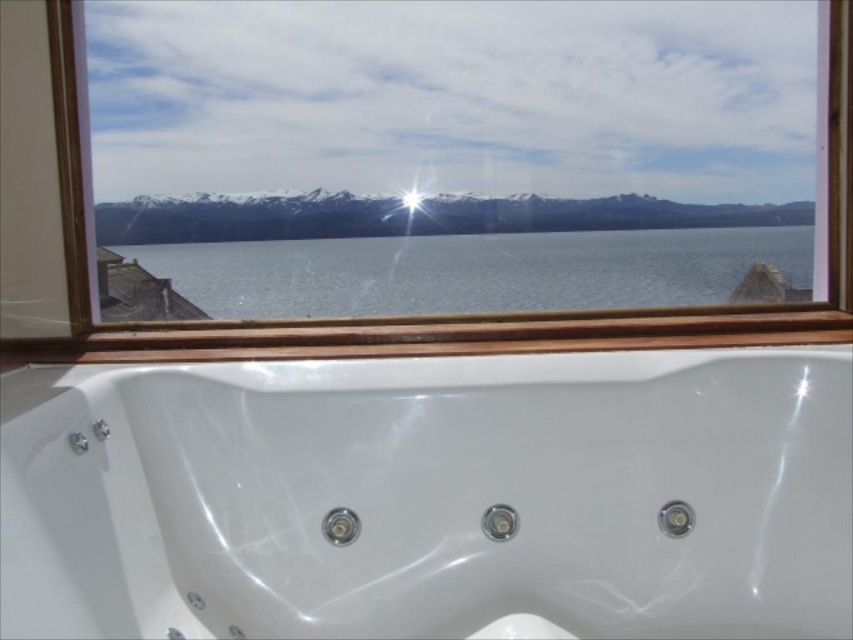
From the picture: Is white glossy bathtub at center wider than clear water at center?

No.

Between white glossy bathtub at center and clear water at center, which one has more height?

white glossy bathtub at center

Which is in front, point (265, 460) or point (587, 256)?

Point (265, 460) is in front.

The width and height of the screenshot is (853, 640). Identify the location of white glossy bathtub at center. (428, 496).

Is white glossy bathtub at center smaller than wooden frame at upper center?

Actually, white glossy bathtub at center might be larger than wooden frame at upper center.

Who is taller, white glossy bathtub at center or wooden frame at upper center?

wooden frame at upper center is taller.

The height and width of the screenshot is (640, 853). What do you see at coordinates (428, 496) in the screenshot?
I see `white glossy bathtub at center` at bounding box center [428, 496].

The width and height of the screenshot is (853, 640). I want to click on white glossy bathtub at center, so click(428, 496).

Which is behind, point (387, 577) or point (572, 225)?

Point (572, 225)

I want to click on white glossy bathtub at center, so click(428, 496).